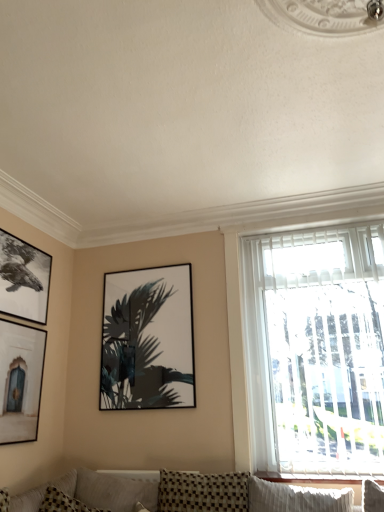
Question: Should I look upward or downward to see matte black picture frame at center, which is the third picture frame in left-to-right order?

Choices:
 (A) down
 (B) up

Answer: (A)

Question: Is matte black picture frame at left, which is the 2th picture frame from right to left, positioned with its back to checkered fabric pillow at lower left?

Choices:
 (A) no
 (B) yes

Answer: (A)

Question: Considering the relative sizes of matte black picture frame at left, the 2th picture frame viewed from the left, and checkered fabric pillow at lower left in the image provided, is matte black picture frame at left, the 2th picture frame viewed from the left, bigger than checkered fabric pillow at lower left?

Choices:
 (A) no
 (B) yes

Answer: (A)

Question: Is matte black picture frame at left, which is the 2th picture frame from right to left, thinner than checkered fabric pillow at lower left?

Choices:
 (A) yes
 (B) no

Answer: (A)

Question: From the image's perspective, is matte black picture frame at left, which is the 2th picture frame from right to left, above checkered fabric pillow at lower left?

Choices:
 (A) no
 (B) yes

Answer: (B)

Question: Can checkered fabric pillow at lower left be found inside matte black picture frame at left, which is the 2th picture frame from right to left?

Choices:
 (A) no
 (B) yes

Answer: (A)

Question: Is matte black picture frame at left, which is the 2th picture frame from right to left, shorter than checkered fabric pillow at lower left?

Choices:
 (A) yes
 (B) no

Answer: (B)

Question: Is white wood window sill at lower right placed right next to matte black picture frame at center, arranged as the 1th picture frame when viewed from the right?

Choices:
 (A) no
 (B) yes

Answer: (A)

Question: Is white wood window sill at lower right to the left of matte black picture frame at center, which is the third picture frame in left-to-right order, from the viewer's perspective?

Choices:
 (A) yes
 (B) no

Answer: (B)

Question: Would you consider white wood window sill at lower right to be distant from matte black picture frame at center, which is the third picture frame in left-to-right order?

Choices:
 (A) no
 (B) yes

Answer: (B)

Question: Does white wood window sill at lower right appear on the right side of matte black picture frame at center, which is the third picture frame in left-to-right order?

Choices:
 (A) yes
 (B) no

Answer: (A)

Question: Does white wood window sill at lower right have a larger size compared to matte black picture frame at center, arranged as the 1th picture frame when viewed from the right?

Choices:
 (A) no
 (B) yes

Answer: (A)

Question: From a real-world perspective, is white wood window sill at lower right on top of matte black picture frame at center, arranged as the 1th picture frame when viewed from the right?

Choices:
 (A) yes
 (B) no

Answer: (B)

Question: Is matte black picture frame at center, arranged as the 1th picture frame when viewed from the right, aimed at black matte picture frame at upper left, the 1th picture frame when ordered from left to right?

Choices:
 (A) no
 (B) yes

Answer: (A)